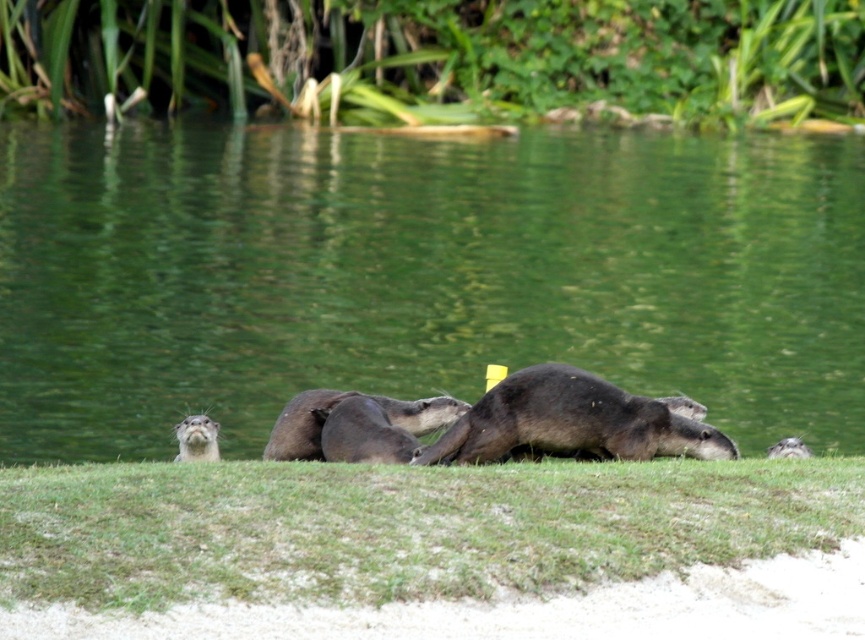
Is point (232, 211) in front of point (177, 454)?

No, it is behind (177, 454).

Is green water at center to the left of soft brown otter at center from the viewer's perspective?

Correct, you'll find green water at center to the left of soft brown otter at center.

Who is more forward, (456, 144) or (180, 444)?

Point (180, 444) is in front.

Locate an element on the screen. This screenshot has width=865, height=640. green water at center is located at coordinates (418, 276).

Consider the image. How distant is green water at center from brown fur otter at center?

green water at center and brown fur otter at center are 10.02 meters apart from each other.

Which is behind, point (308, 288) or point (411, 435)?

The point (308, 288) is more distant.

Is point (594, 362) less distant than point (298, 428)?

No, it is not.

The image size is (865, 640). Find the location of `green water at center`. green water at center is located at coordinates (418, 276).

Is point (272, 552) more distant than point (187, 429)?

No, it is in front of (187, 429).

Consider the image. Is green grass at lower center closer to the viewer compared to soft brown otter at center?

Yes, it is.

The height and width of the screenshot is (640, 865). Identify the location of green grass at lower center. (399, 525).

Locate an element on the screen. The width and height of the screenshot is (865, 640). green grass at lower center is located at coordinates (399, 525).